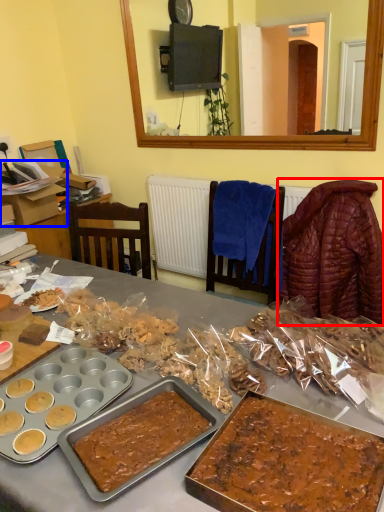
Question: Which of the following is the farthest to the observer, blanket (highlighted by a red box) or box (highlighted by a blue box)?

Choices:
 (A) blanket
 (B) box

Answer: (B)